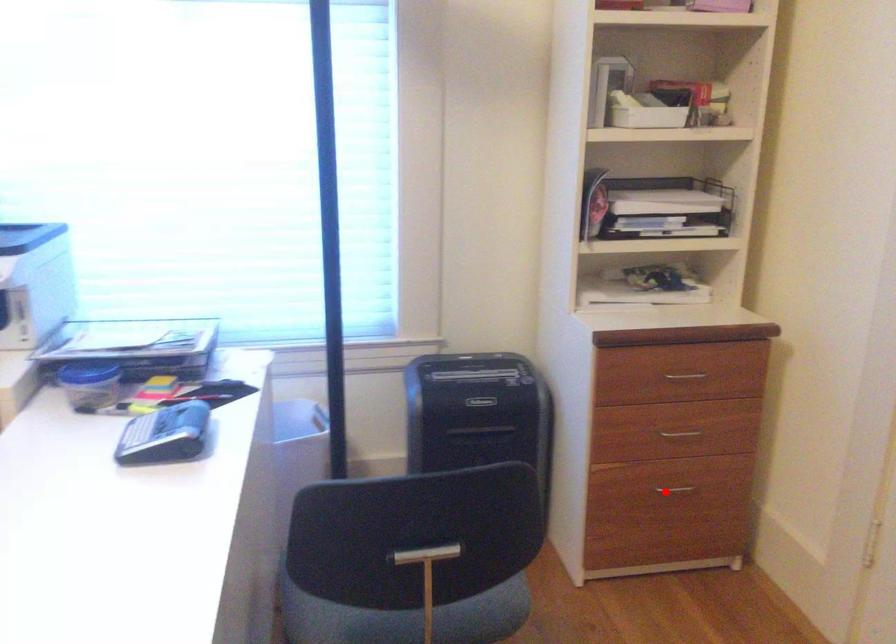
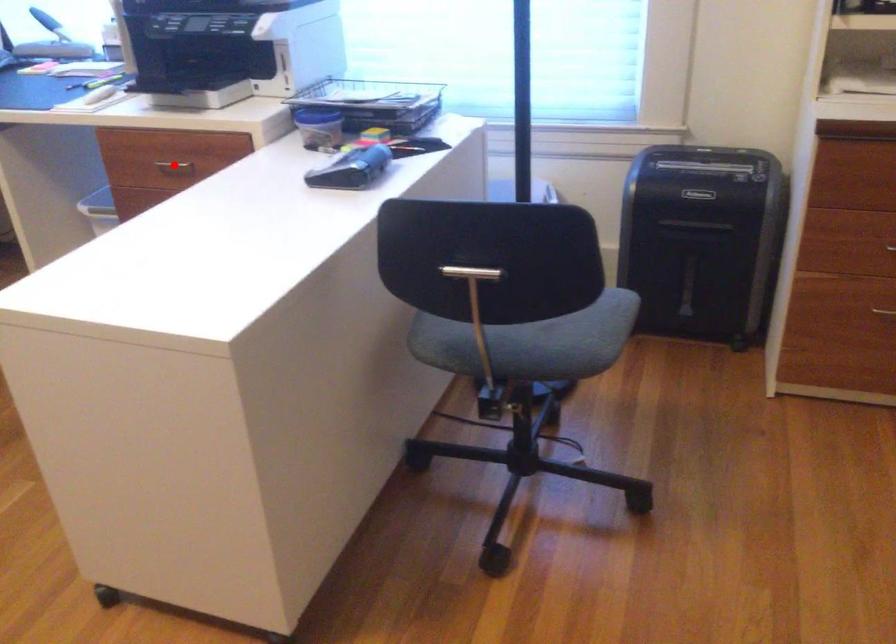
I am providing you with two images of the same scene from different viewpoints. A red point is marked on the first image and another point is marked on the second image. Does the point marked in image1 correspond to the same location as the one in image2?

No